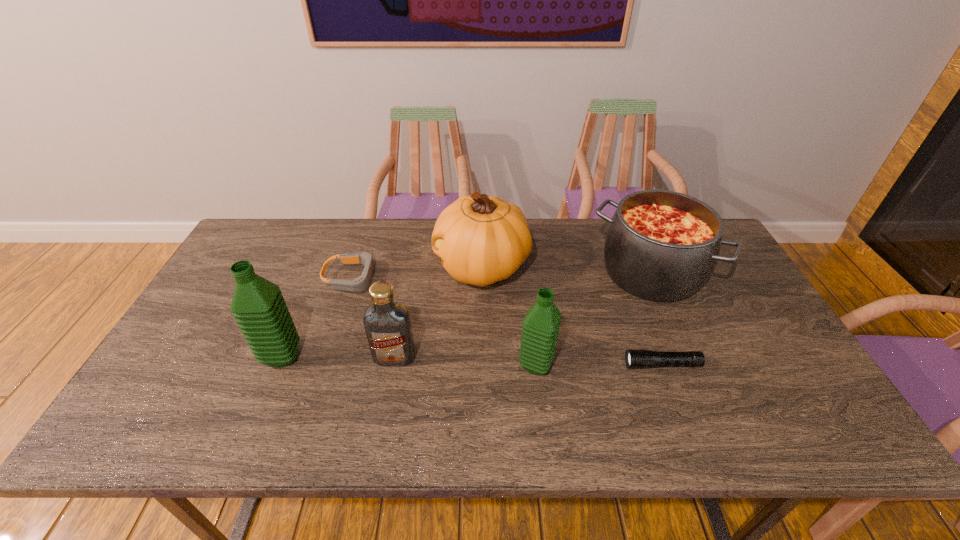
The width and height of the screenshot is (960, 540). I want to click on vacant space situated 0.240m on the front face of the pumpkin, so click(x=357, y=267).

At what (x,y) coordinates should I click in order to perform the action: click on free location located 0.140m on the front face of the pumpkin. Please return your answer as a coordinate pair (x, y). The image size is (960, 540). Looking at the image, I should click on (390, 267).

Locate an element on the screen. Image resolution: width=960 pixels, height=540 pixels. free space located on the front and back of the goggles is located at coordinates (429, 278).

This screenshot has width=960, height=540. What are the coordinates of `free location located 0.130m on the front of the casserole` in the screenshot? It's located at (682, 345).

Locate an element on the screen. The width and height of the screenshot is (960, 540). free space located 0.070m on the front-facing side of the third object from left to right is located at coordinates [388, 392].

Locate an element on the screen. This screenshot has height=540, width=960. free space located at the lens end of the flashlight is located at coordinates (493, 364).

Identify the location of vacant space located 0.150m at the lens end of the flashlight. The image size is (960, 540). (565, 364).

This screenshot has width=960, height=540. I want to click on vacant space located 0.400m at the lens end of the flashlight, so click(466, 364).

Locate an element on the screen. pumpkin positioned at the far edge is located at coordinates (481, 239).

Where is `goggles present at the far edge`? goggles present at the far edge is located at coordinates coord(360,284).